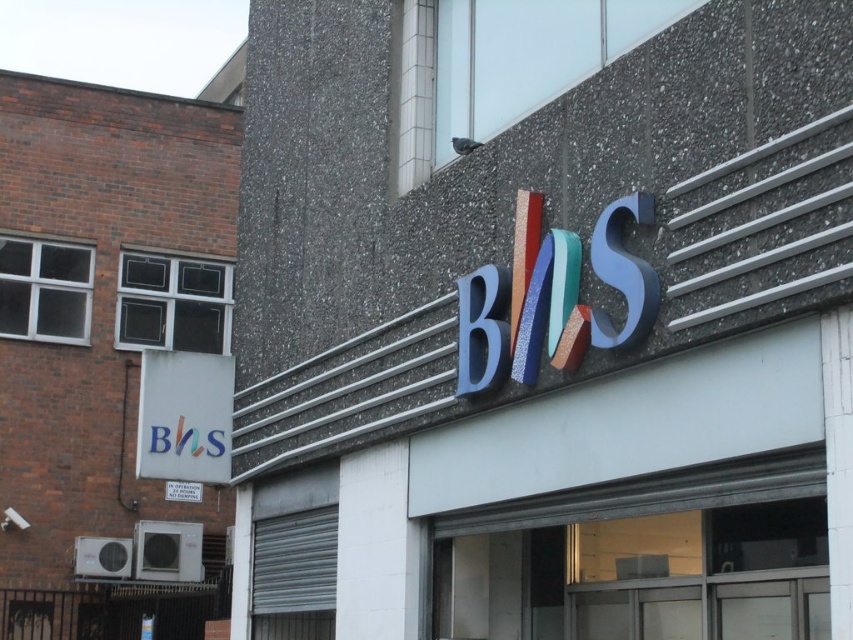
Which is more to the left, multicolored plastic sign at center or matte white sign at lower left?

Positioned to the left is matte white sign at lower left.

Is multicolored plastic sign at center thinner than matte white sign at lower left?

No, multicolored plastic sign at center is not thinner than matte white sign at lower left.

Describe the element at coordinates (544, 320) in the screenshot. I see `multicolored plastic sign at center` at that location.

You are a GUI agent. You are given a task and a screenshot of the screen. Output one action in this format:
    pyautogui.click(x=<x>, y=<y>)
    Task: Click on the multicolored plastic sign at center
    Image resolution: width=853 pixels, height=640 pixels.
    Given the screenshot: What is the action you would take?
    pyautogui.click(x=544, y=320)